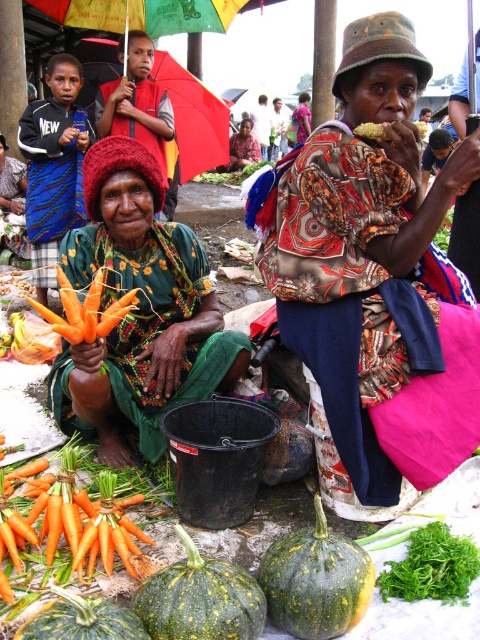
Question: Is orange smooth carrot at lower left smaller than orange matte carrots at lower left?

Choices:
 (A) no
 (B) yes

Answer: (B)

Question: Is orange smooth carrot at lower left closer to the viewer compared to orange matte carrots at lower left?

Choices:
 (A) yes
 (B) no

Answer: (B)

Question: Which of the following is the farthest from the observer?

Choices:
 (A) green textured squash at center
 (B) printed fabric bag at upper right

Answer: (B)

Question: Which is farther from the green leafy at center?

Choices:
 (A) orange smooth carrot at lower left
 (B) green woven cloth at center

Answer: (B)

Question: Does orange smooth carrot at lower left appear over red fabric umbrella at upper left?

Choices:
 (A) yes
 (B) no

Answer: (B)

Question: Which point is closer to the camera?

Choices:
 (A) orange smooth carrot at lower left
 (B) green textured squash at center

Answer: (B)